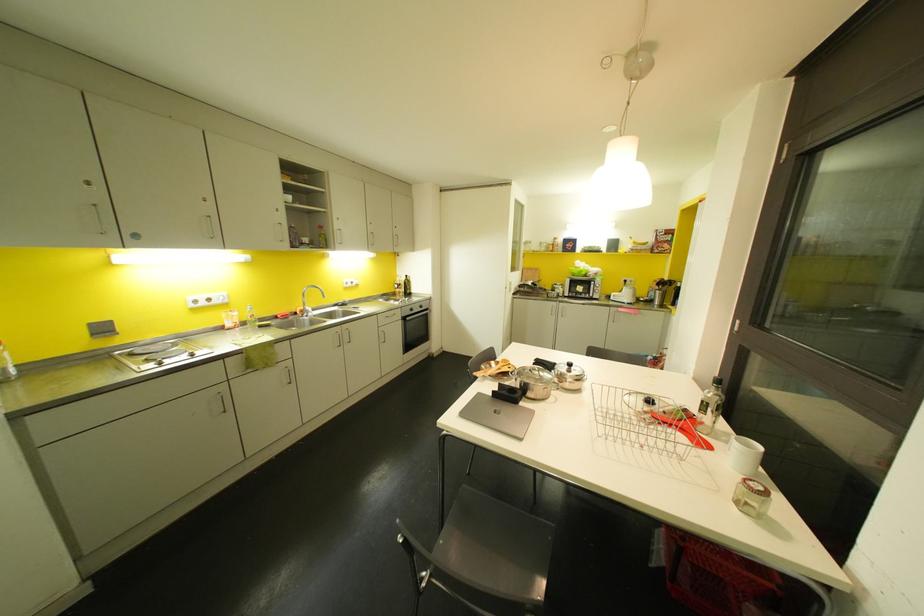
The location [710,407] corresponds to which object?

It refers to a glass bottle.